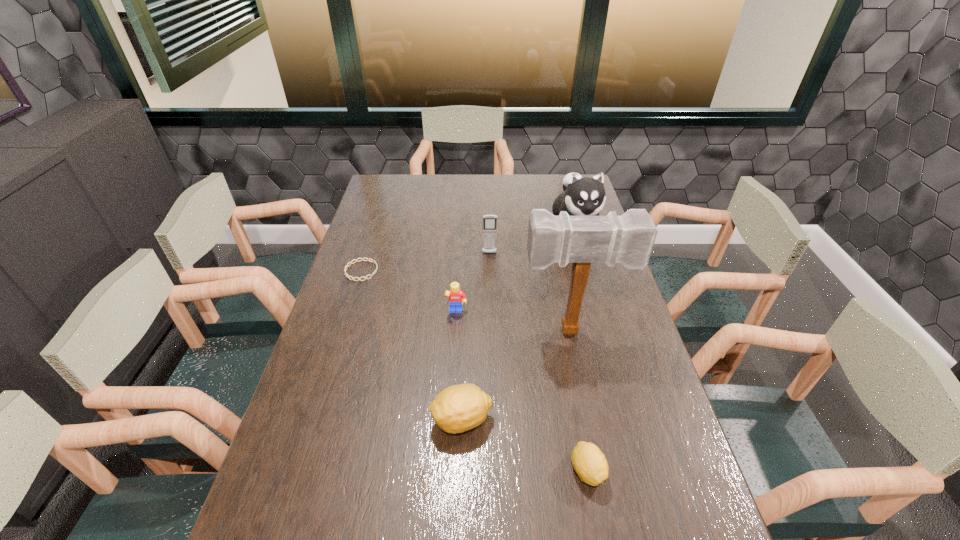
Locate an element on the screen. The height and width of the screenshot is (540, 960). the taller lemon is located at coordinates (459, 408).

The height and width of the screenshot is (540, 960). In order to click on the farther lemon in this screenshot , I will do `click(459, 408)`.

Identify the location of the sixth tallest object. Image resolution: width=960 pixels, height=540 pixels. (590, 464).

At what (x,y) coordinates should I click in order to perform the action: click on the right lemon. Please return your answer as a coordinate pair (x, y). This screenshot has height=540, width=960. Looking at the image, I should click on (590, 464).

I want to click on puppy, so click(x=582, y=196).

Image resolution: width=960 pixels, height=540 pixels. I want to click on the third tallest object, so click(489, 221).

You are a GUI agent. You are given a task and a screenshot of the screen. Output one action in this format:
    pyautogui.click(x=<x>, y=<y>)
    Task: Click on the fourth nearest object
    
    Given the screenshot: What is the action you would take?
    pyautogui.click(x=455, y=295)

Identify the location of the shortest object. This screenshot has height=540, width=960. (369, 259).

I want to click on bracelet, so click(x=369, y=259).

This screenshot has height=540, width=960. I want to click on mallet, so click(628, 239).